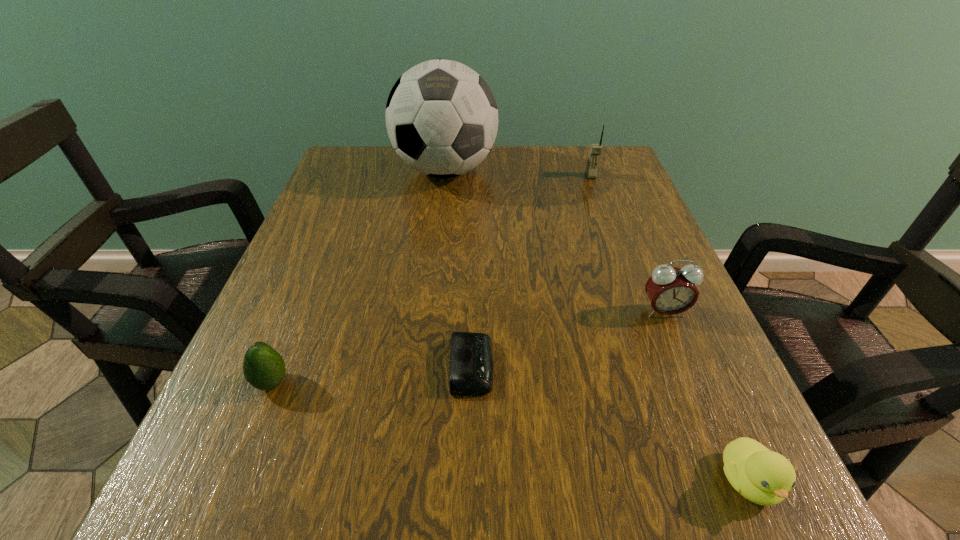
In order to click on soccer ball in this screenshot , I will do `click(441, 116)`.

At what (x,y) coordinates should I click in order to perform the action: click on cellular telephone. Please return your answer as a coordinate pair (x, y). This screenshot has height=540, width=960. Looking at the image, I should click on (595, 150).

This screenshot has width=960, height=540. Identify the location of the third tallest object. (671, 290).

Find the location of a particular element. This screenshot has width=960, height=540. the taller alarm clock is located at coordinates (671, 290).

You are a GUI agent. You are given a task and a screenshot of the screen. Output one action in this format:
    pyautogui.click(x=<x>, y=<y>)
    Task: Click on the leftmost object
    Image resolution: width=960 pixels, height=540 pixels.
    Given the screenshot: What is the action you would take?
    pyautogui.click(x=263, y=367)

The height and width of the screenshot is (540, 960). What are the coordinates of `duckling` in the screenshot? It's located at (764, 477).

Find the location of `the shorter alarm clock`. the shorter alarm clock is located at coordinates click(x=471, y=359).

Locate an element on the screen. the nearer alarm clock is located at coordinates (471, 359).

Where is `free space located 0.250m on the main logo of the tallest object`? Image resolution: width=960 pixels, height=540 pixels. free space located 0.250m on the main logo of the tallest object is located at coordinates (434, 273).

Image resolution: width=960 pixels, height=540 pixels. In order to click on free space located 0.210m on the front of the cellular telephone, where the keypad is located in this screenshot , I will do `click(611, 232)`.